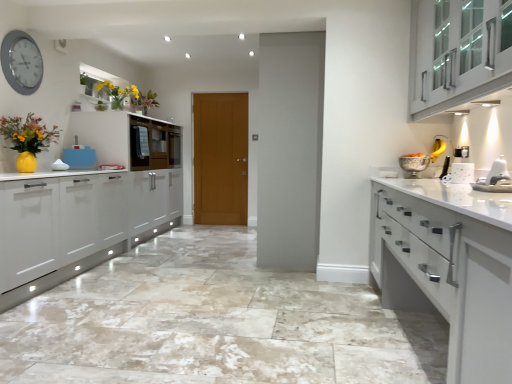
Question: Can you confirm if silver metallic clock at upper left is bigger than white plastic toaster at right?

Choices:
 (A) yes
 (B) no

Answer: (A)

Question: Is silver metallic clock at upper left not inside white plastic toaster at right?

Choices:
 (A) yes
 (B) no

Answer: (A)

Question: Does silver metallic clock at upper left appear on the left side of white plastic toaster at right?

Choices:
 (A) yes
 (B) no

Answer: (A)

Question: Considering the relative positions of silver metallic clock at upper left and white plastic toaster at right in the image provided, is silver metallic clock at upper left to the right of white plastic toaster at right from the viewer's perspective?

Choices:
 (A) yes
 (B) no

Answer: (B)

Question: Can you confirm if silver metallic clock at upper left is thinner than white plastic toaster at right?

Choices:
 (A) no
 (B) yes

Answer: (B)

Question: From a real-world perspective, is white plastic toaster at right above or below white glossy sink at right?

Choices:
 (A) above
 (B) below

Answer: (B)

Question: From the image's perspective, is white plastic toaster at right above or below white glossy sink at right?

Choices:
 (A) above
 (B) below

Answer: (A)

Question: Looking at their shapes, would you say white plastic toaster at right is wider or thinner than white glossy sink at right?

Choices:
 (A) wide
 (B) thin

Answer: (B)

Question: Is white plastic toaster at right inside or outside of white glossy sink at right?

Choices:
 (A) inside
 (B) outside

Answer: (B)

Question: Would you say white plastic toaster at right is to the left or to the right of marble tile floor at center in the picture?

Choices:
 (A) left
 (B) right

Answer: (B)

Question: From a real-world perspective, is white plastic toaster at right positioned above or below marble tile floor at center?

Choices:
 (A) above
 (B) below

Answer: (A)

Question: From their relative heights in the image, would you say white plastic toaster at right is taller or shorter than marble tile floor at center?

Choices:
 (A) short
 (B) tall

Answer: (B)

Question: Relative to marble tile floor at center, is white plastic toaster at right in front or behind?

Choices:
 (A) front
 (B) behind

Answer: (B)

Question: Does point (445, 221) appear closer or farther from the camera than point (474, 56)?

Choices:
 (A) farther
 (B) closer

Answer: (B)

Question: Is white glossy cabinet at right, the 2th cabinetry from the right, taller or shorter than white glossy cabinet at upper right, which is the first cabinetry from right to left?

Choices:
 (A) tall
 (B) short

Answer: (B)